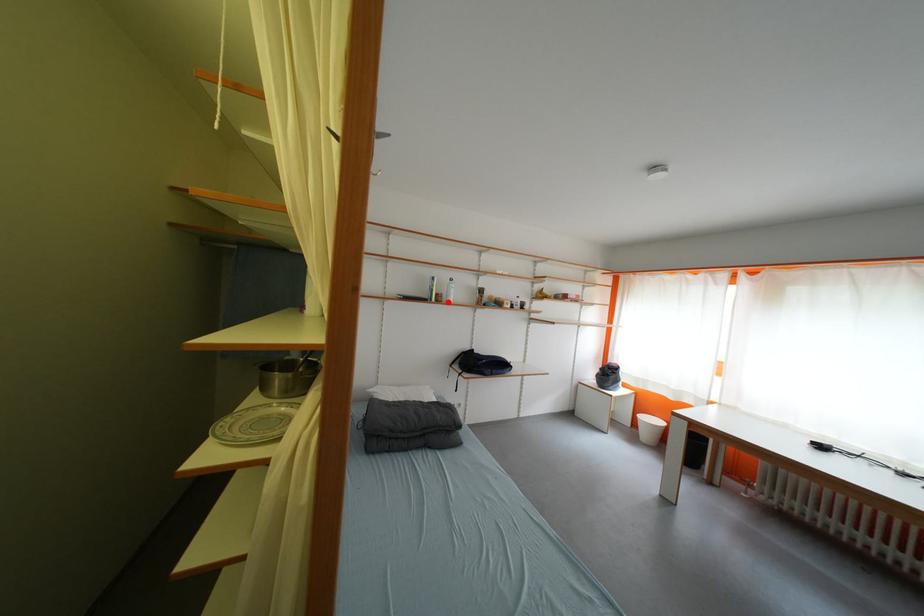
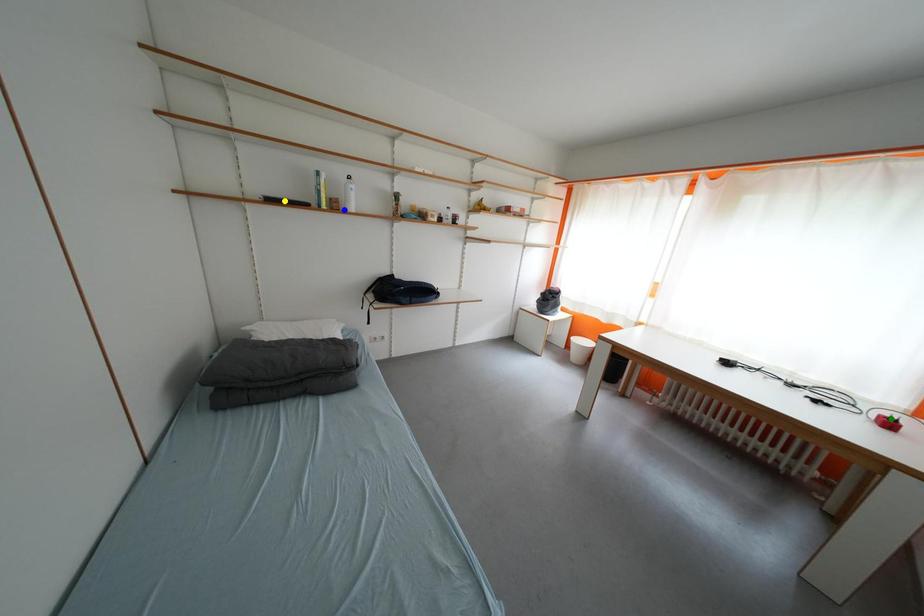
Question: I am providing you with two images of the same scene from different viewpoints. A red point is marked on the first image. You are given multiple points on the second image. In image 2, which mark is for the same physical point as the one in image 1?

Choices:
 (A) green point
 (B) yellow point
 (C) blue point

Answer: (C)